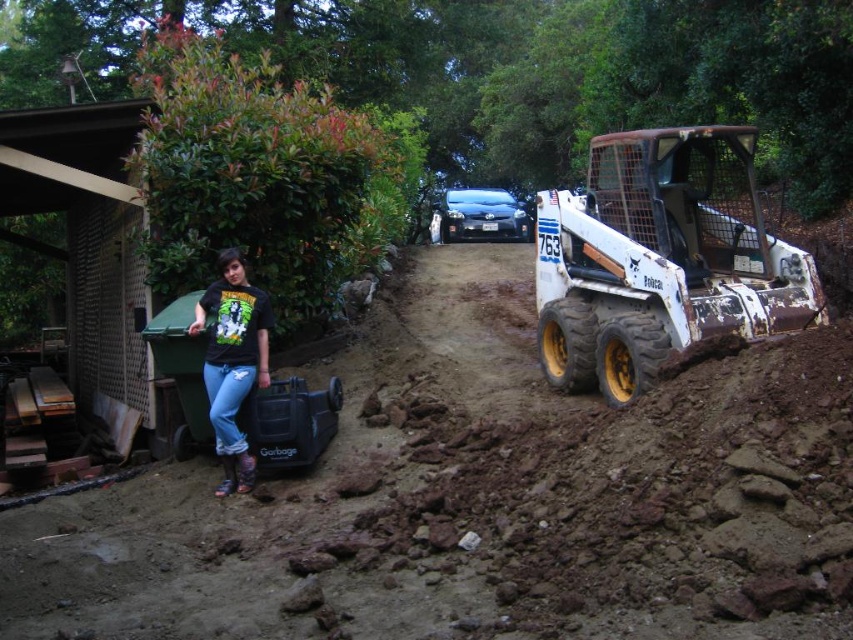
Question: Which is nearer to the white rusty tractor at right?

Choices:
 (A) brown clay dirt at center
 (B) black matte shirt at left

Answer: (A)

Question: Can you confirm if brown clay dirt at center is positioned to the right of black matte shirt at left?

Choices:
 (A) yes
 (B) no

Answer: (A)

Question: Which object is the closest to the white rusty tractor at right?

Choices:
 (A) black matte shirt at left
 (B) brown clay dirt at center

Answer: (B)

Question: Considering the real-world distances, which object is farthest from the black matte shirt at left?

Choices:
 (A) white rusty tractor at right
 (B) brown clay dirt at center

Answer: (A)

Question: Can you confirm if brown clay dirt at center is bigger than black matte shirt at left?

Choices:
 (A) no
 (B) yes

Answer: (B)

Question: Can you confirm if brown clay dirt at center is positioned above black matte shirt at left?

Choices:
 (A) no
 (B) yes

Answer: (A)